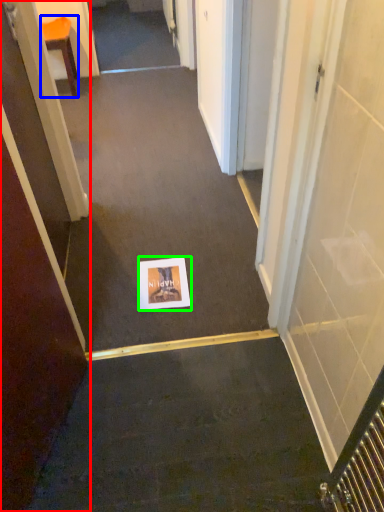
Question: Considering the real-world distances, which object is closest to door (highlighted by a red box)? furniture (highlighted by a blue box) or postcard (highlighted by a green box).

Choices:
 (A) furniture
 (B) postcard

Answer: (B)